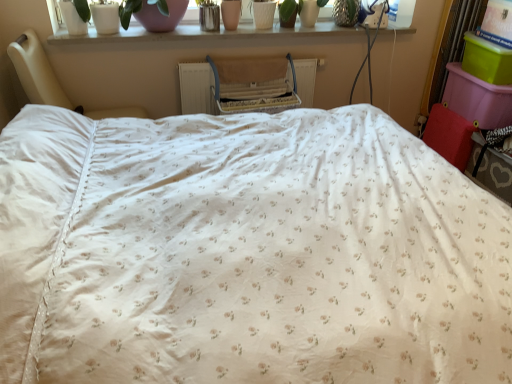
Question: From a real-world perspective, is white matte pot at upper center beneath white floral fabric bed at center?

Choices:
 (A) yes
 (B) no

Answer: (B)

Question: Considering the relative sizes of white matte pot at upper center and white floral fabric bed at center in the image provided, is white matte pot at upper center taller than white floral fabric bed at center?

Choices:
 (A) yes
 (B) no

Answer: (B)

Question: Is white matte pot at upper center turned away from white floral fabric bed at center?

Choices:
 (A) no
 (B) yes

Answer: (A)

Question: Is white matte pot at upper center positioned before white floral fabric bed at center?

Choices:
 (A) yes
 (B) no

Answer: (B)

Question: Is white matte pot at upper center to the right of white floral fabric bed at center from the viewer's perspective?

Choices:
 (A) yes
 (B) no

Answer: (A)

Question: Is white matte pot at upper center wider than white floral fabric bed at center?

Choices:
 (A) yes
 (B) no

Answer: (B)

Question: Considering the relative sizes of white floral fabric bed at center and white plastic window screen at upper right in the image provided, is white floral fabric bed at center smaller than white plastic window screen at upper right?

Choices:
 (A) yes
 (B) no

Answer: (B)

Question: From a real-world perspective, is white floral fabric bed at center physically above white plastic window screen at upper right?

Choices:
 (A) yes
 (B) no

Answer: (B)

Question: Is white floral fabric bed at center further to the viewer compared to white plastic window screen at upper right?

Choices:
 (A) yes
 (B) no

Answer: (B)

Question: Would you say white floral fabric bed at center is a long distance from white plastic window screen at upper right?

Choices:
 (A) no
 (B) yes

Answer: (B)

Question: From a real-world perspective, is white floral fabric bed at center physically below white plastic window screen at upper right?

Choices:
 (A) no
 (B) yes

Answer: (B)

Question: Is white plastic window screen at upper right located within white floral fabric bed at center?

Choices:
 (A) yes
 (B) no

Answer: (B)

Question: From a real-world perspective, is white floral fabric bed at center positioned under white plastic radiator at center based on gravity?

Choices:
 (A) no
 (B) yes

Answer: (B)